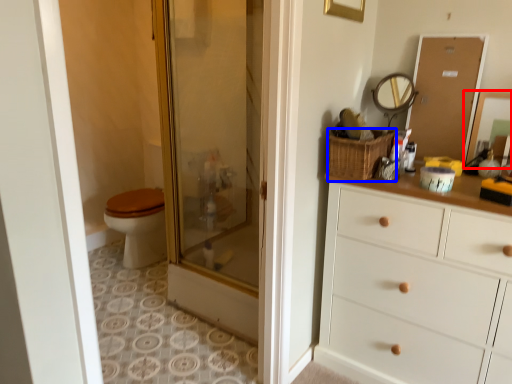
Question: Among these objects, which one is farthest to the camera, mirror (highlighted by a red box) or basket (highlighted by a blue box)?

Choices:
 (A) mirror
 (B) basket

Answer: (B)